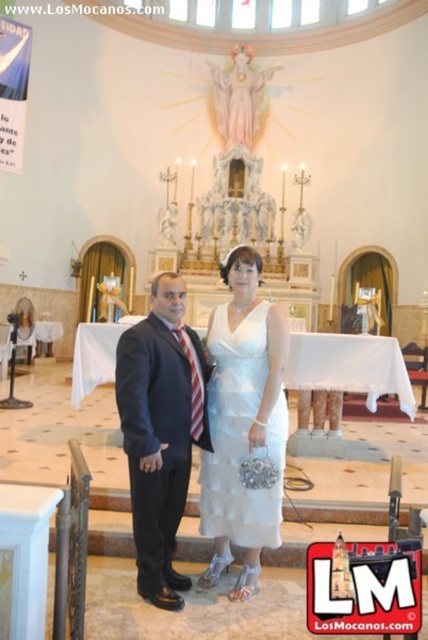
You are a photographer standing at the back of the church. You want to take a photo of the matte black suit at center and white satin dress at center so that both are in focus. The camera you are using has a depth of field that can cover 9 feet. Will both subjects be in focus?

The matte black suit at center and white satin dress at center are 8.95 feet apart. Since the camera can cover 9 feet, both subjects will be in focus.